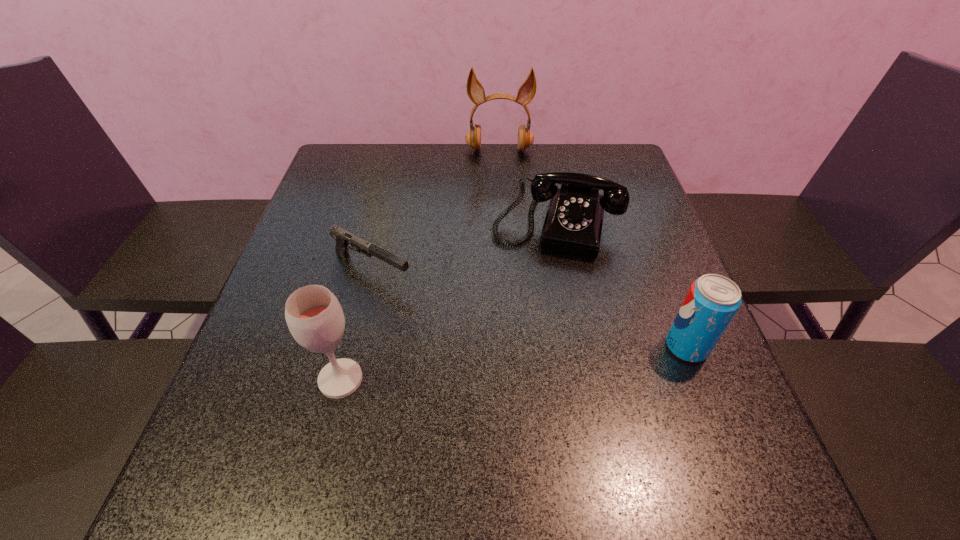
This screenshot has height=540, width=960. What are the coordinates of `free space located 0.350m on the front-facing side of the farthest object` in the screenshot? It's located at (500, 233).

Find the location of `free space located 0.300m on the dial of the telephone`. free space located 0.300m on the dial of the telephone is located at coordinates (516, 369).

I want to click on free point located 0.280m on the dial of the telephone, so click(519, 360).

Where is `free location located on the dial of the telephone`? free location located on the dial of the telephone is located at coordinates (530, 316).

Find the location of `vacant position located at the muzzle end of the gun`. vacant position located at the muzzle end of the gun is located at coordinates (472, 320).

You are a GUI agent. You are given a task and a screenshot of the screen. Output one action in this format:
    pyautogui.click(x=<x>, y=<y>)
    Task: Click on the vacant space located 0.400m at the muzzle end of the gun
    This screenshot has width=960, height=540.
    Given the screenshot: What is the action you would take?
    pyautogui.click(x=571, y=373)

Locate an element on the screen. vacant area situated at the muzzle end of the gun is located at coordinates (542, 357).

Locate an element on the screen. The height and width of the screenshot is (540, 960). object located at the far edge is located at coordinates (475, 90).

Identify the location of object present at the near edge. (314, 316).

Where is `wineglass located in the left edge section of the desktop`? This screenshot has height=540, width=960. wineglass located in the left edge section of the desktop is located at coordinates (314, 316).